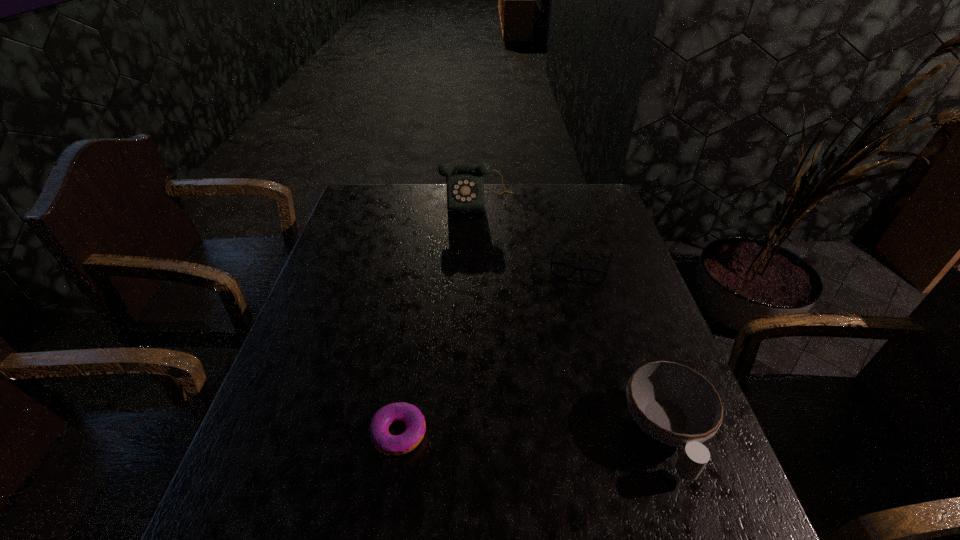
This screenshot has width=960, height=540. Identify the location of free spot at the near edge of the desktop. (589, 462).

In the image, there is a desktop. Where is `vacant space at the left edge`? vacant space at the left edge is located at coordinates (361, 221).

This screenshot has width=960, height=540. What are the coordinates of `free space at the right edge of the desktop` in the screenshot? It's located at (633, 261).

This screenshot has width=960, height=540. In order to click on free spot at the far left corner of the desktop in this screenshot , I will do `click(373, 184)`.

You are a GUI agent. You are given a task and a screenshot of the screen. Output one action in this format:
    pyautogui.click(x=<x>, y=<y>)
    Task: Click on the free space between the chinaware and the telephone
    
    Given the screenshot: What is the action you would take?
    pyautogui.click(x=572, y=317)

Locate an element on the screen. The height and width of the screenshot is (540, 960). free space that is in between the third shortest object and the second farthest object is located at coordinates (624, 349).

The image size is (960, 540). Find the location of `vacant area between the spectacles and the third shortest object`. vacant area between the spectacles and the third shortest object is located at coordinates (624, 349).

Where is `blank region between the telephone and the second tallest object`? blank region between the telephone and the second tallest object is located at coordinates (572, 317).

The width and height of the screenshot is (960, 540). In order to click on vacant space in between the tallest object and the second farthest object in this screenshot , I will do `click(529, 233)`.

Find the location of a particular element. free space between the third nearest object and the telephone is located at coordinates (529, 233).